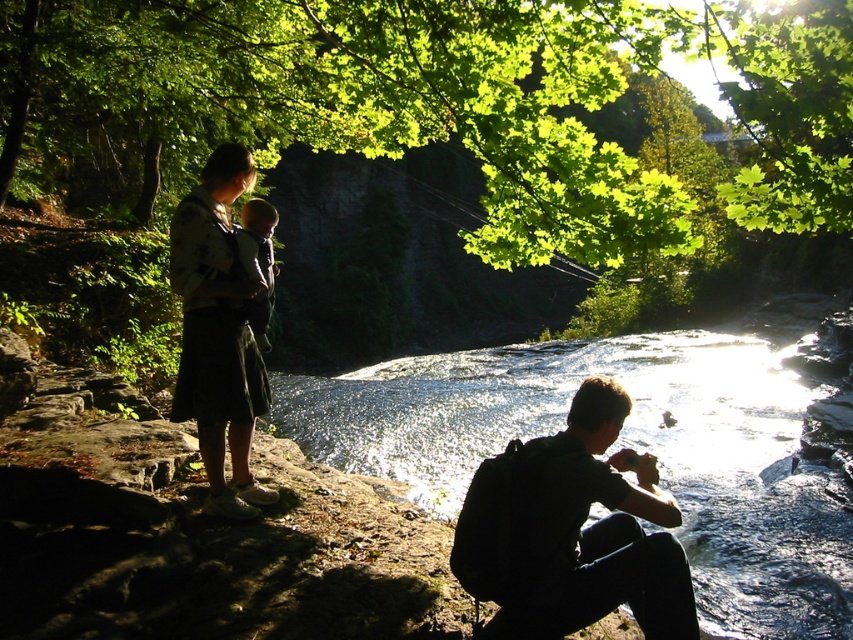
In the scene shown: Who is positioned more to the right, translucent water at center or soft gray fabric baby at center?

translucent water at center is more to the right.

Does translucent water at center have a greater width compared to soft gray fabric baby at center?

Correct, the width of translucent water at center exceeds that of soft gray fabric baby at center.

What do you see at coordinates (635, 444) in the screenshot? This screenshot has height=640, width=853. I see `translucent water at center` at bounding box center [635, 444].

What are the coordinates of `translucent water at center` in the screenshot? It's located at (635, 444).

Who is lower down, black matte shirt at lower right or dark gray skirt at left?

black matte shirt at lower right is below.

Does black matte shirt at lower right appear under dark gray skirt at left?

Indeed, black matte shirt at lower right is positioned under dark gray skirt at left.

Does point (596, 554) come in front of point (245, 492)?

Yes, point (596, 554) is in front of point (245, 492).

This screenshot has height=640, width=853. In order to click on black matte shirt at lower right in this screenshot , I will do `click(573, 531)`.

Who is higher up, green leafy tree at upper center or translucent water at center?

green leafy tree at upper center is above.

Is green leafy tree at upper center closer to camera compared to translucent water at center?

Yes.

Between point (560, 38) and point (717, 556), which one is positioned in front?

Point (717, 556) is more forward.

In order to click on green leafy tree at upper center in this screenshot , I will do `click(439, 100)`.